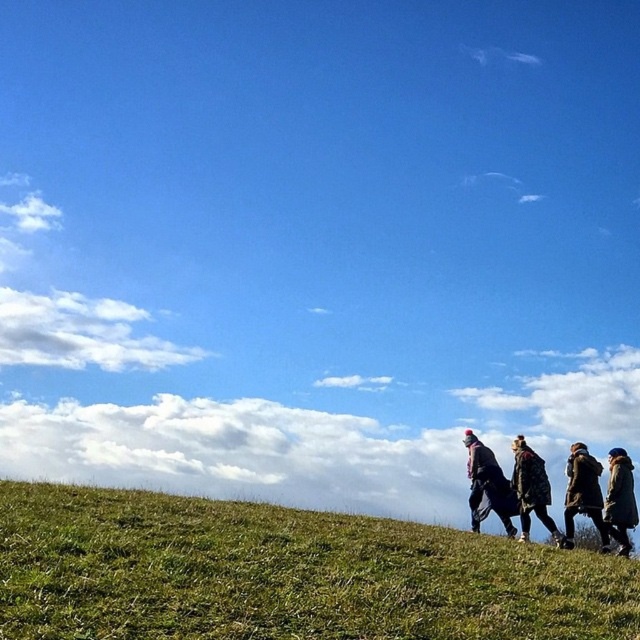
Is point (545, 524) more distant than point (624, 484)?

Yes.

Between camouflage jacket at lower right and dark brown textured coat at lower right, which one appears on the right side from the viewer's perspective?

Positioned to the right is dark brown textured coat at lower right.

Which is behind, point (531, 467) or point (616, 500)?

The point (531, 467) is behind.

Find the location of a particular element. This screenshot has height=640, width=640. camouflage jacket at lower right is located at coordinates (531, 490).

From the picture: Can you confirm if dark brown leather jacket at right is taller than dark brown textured coat at lower right?

Yes.

Based on the photo, is the position of dark brown leather jacket at right less distant than that of dark brown textured coat at lower right?

No, dark brown leather jacket at right is behind dark brown textured coat at lower right.

Who is more forward, (588,513) or (620,477)?

Positioned in front is point (620,477).

At what (x,y) coordinates should I click in order to perform the action: click on dark brown leather jacket at right. Please return your answer as a coordinate pair (x, y). Looking at the image, I should click on point(582,493).

Can you confirm if green grassy hillside at lower center is smaller than camouflage jacket at lower right?

Actually, green grassy hillside at lower center might be larger than camouflage jacket at lower right.

Is green grassy hillside at lower center taller than camouflage jacket at lower right?

No.

Does point (605, 596) come farther from viewer compared to point (522, 481)?

No, it is not.

You are a GUI agent. You are given a task and a screenshot of the screen. Output one action in this format:
    pyautogui.click(x=<x>, y=<y>)
    Task: Click on the green grassy hillside at lower center
    The width and height of the screenshot is (640, 640).
    Given the screenshot: What is the action you would take?
    pyautogui.click(x=284, y=573)